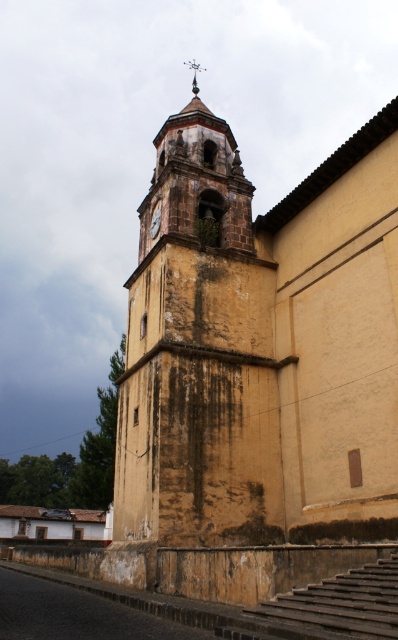
Does yellowish stucco tower at center have a greater width compared to brown wooden clock at center?

Yes, yellowish stucco tower at center is wider than brown wooden clock at center.

Which is behind, point (267, 378) or point (154, 221)?

The point (154, 221) is more distant.

Identify the location of yellowish stucco tower at center. The height and width of the screenshot is (640, 398). (199, 353).

Is point (142, 522) closer to viewer compared to point (386, 609)?

No, it is not.

Which is above, yellowish stucco tower at center or brown stone stairs at lower right?

yellowish stucco tower at center is above.

Identify the location of yellowish stucco tower at center. The image size is (398, 640). (199, 353).

Is point (337, 628) positioned behind point (154, 232)?

That is False.

Identify the location of brown stone stairs at lower right. Image resolution: width=398 pixels, height=640 pixels. (327, 608).